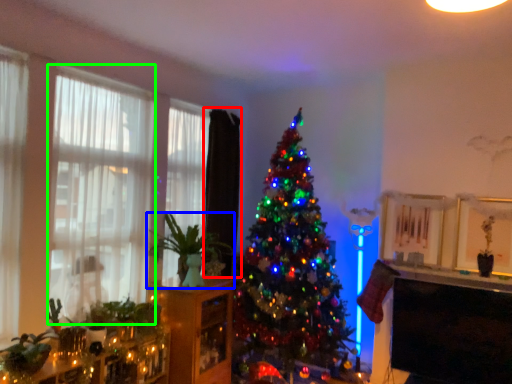
Question: Which object is the closest to the curtain (highlighted by a red box)? Choose among these: houseplant (highlighted by a blue box) or window (highlighted by a green box).

Choices:
 (A) houseplant
 (B) window

Answer: (A)